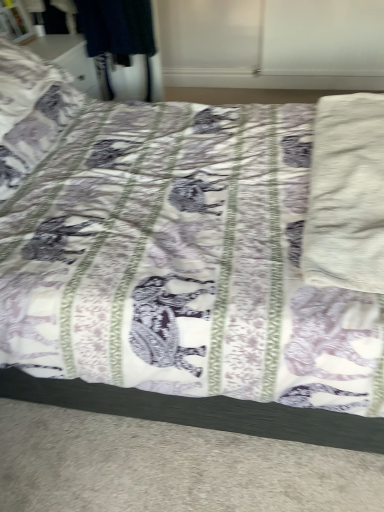
Describe the element at coordinates (346, 195) in the screenshot. I see `white cotton towel at right` at that location.

Identify the location of white cotton towel at right. The width and height of the screenshot is (384, 512). (346, 195).

What is the approximate height of white cotton towel at right?

white cotton towel at right is 5.18 inches in height.

What are the coordinates of `white cotton towel at right` in the screenshot? It's located at (346, 195).